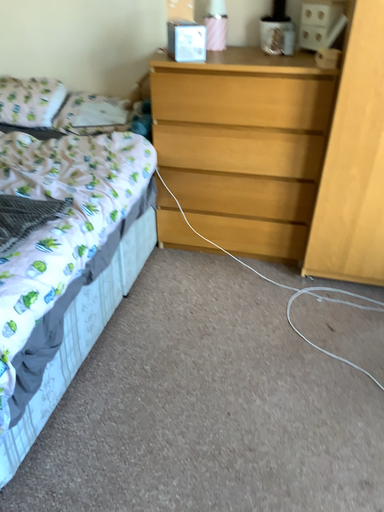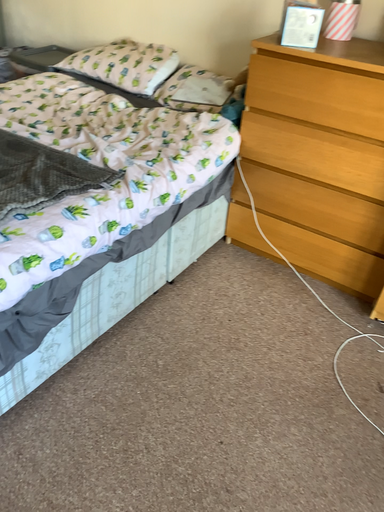
Question: Which way did the camera rotate in the video?

Choices:
 (A) rotated right
 (B) rotated left

Answer: (B)